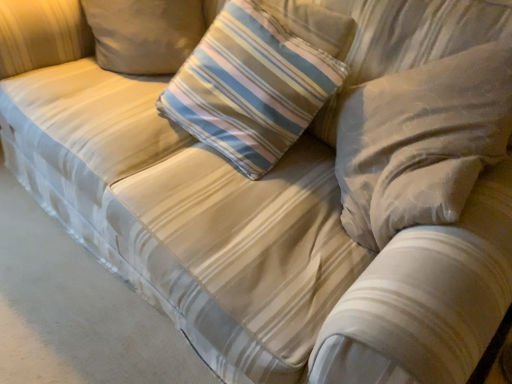
Where is `striped fabric pillow at center`? striped fabric pillow at center is located at coordinates (250, 87).

What do you see at coordinates (250, 87) in the screenshot?
I see `striped fabric pillow at center` at bounding box center [250, 87].

Image resolution: width=512 pixels, height=384 pixels. I want to click on striped fabric pillow at center, so click(x=250, y=87).